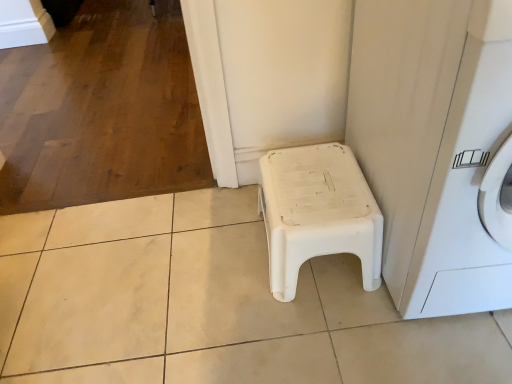
Question: Is white plastic stool at center closer to camera compared to white plastic washing machine at lower right?

Choices:
 (A) no
 (B) yes

Answer: (A)

Question: Is white plastic stool at center behind white plastic washing machine at lower right?

Choices:
 (A) yes
 (B) no

Answer: (A)

Question: From a real-world perspective, does white plastic stool at center stand above white plastic washing machine at lower right?

Choices:
 (A) yes
 (B) no

Answer: (B)

Question: Could you tell me if white plastic stool at center is facing white plastic washing machine at lower right?

Choices:
 (A) no
 (B) yes

Answer: (A)

Question: Does white plastic stool at center have a lesser width compared to white plastic washing machine at lower right?

Choices:
 (A) yes
 (B) no

Answer: (A)

Question: From a real-world perspective, does white plastic stool at center sit lower than white plastic washing machine at lower right?

Choices:
 (A) no
 (B) yes

Answer: (B)

Question: Does white plastic washing machine at lower right have a lesser height compared to white plastic stool at center?

Choices:
 (A) no
 (B) yes

Answer: (A)

Question: Can you see white plastic washing machine at lower right touching white plastic stool at center?

Choices:
 (A) no
 (B) yes

Answer: (A)

Question: From a real-world perspective, is white plastic washing machine at lower right on white plastic stool at center?

Choices:
 (A) yes
 (B) no

Answer: (A)

Question: From the image's perspective, is white plastic washing machine at lower right above white plastic stool at center?

Choices:
 (A) no
 (B) yes

Answer: (B)

Question: From a real-world perspective, does white plastic washing machine at lower right sit lower than white plastic stool at center?

Choices:
 (A) no
 (B) yes

Answer: (A)

Question: Can you confirm if white plastic washing machine at lower right is smaller than white plastic stool at center?

Choices:
 (A) no
 (B) yes

Answer: (A)

Question: From their relative heights in the image, would you say white plastic stool at center is taller or shorter than white plastic washing machine at lower right?

Choices:
 (A) tall
 (B) short

Answer: (B)